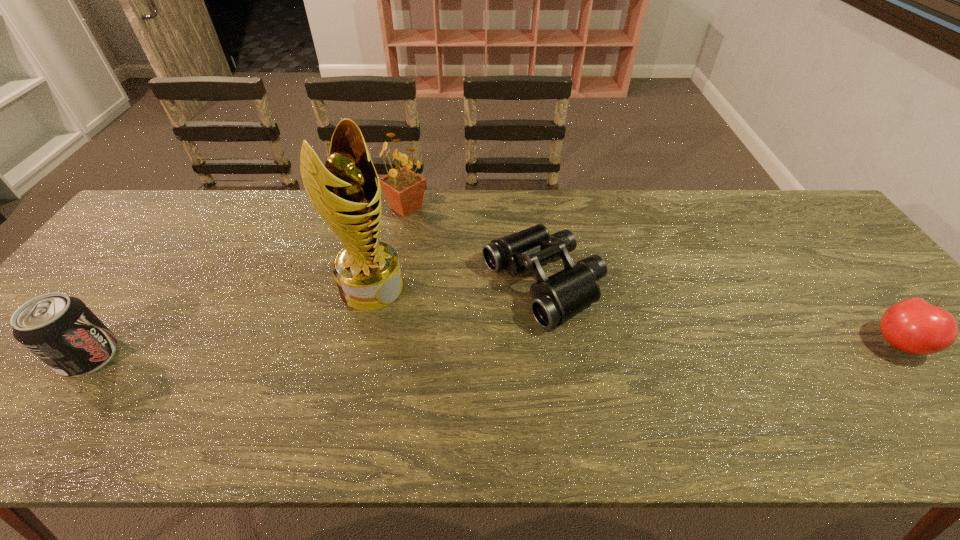
Find the location of a particular element. Image resolution: width=960 pixels, height=540 pixels. free space that satisfies the following two spatial constraints: 1. on the front side of the tallest object; 2. on the stem of the apple is located at coordinates (358, 343).

I want to click on vacant region that satisfies the following two spatial constraints: 1. on the back side of the binoculars; 2. on the left side of the award, so click(372, 285).

Identify the location of free spot that satisfies the following two spatial constraints: 1. on the front side of the rightmost object; 2. on the stem of the fourth shortest object. (380, 343).

This screenshot has height=540, width=960. I want to click on blank area in the image that satisfies the following two spatial constraints: 1. on the front side of the apple; 2. on the stem of the tallest object, so click(358, 343).